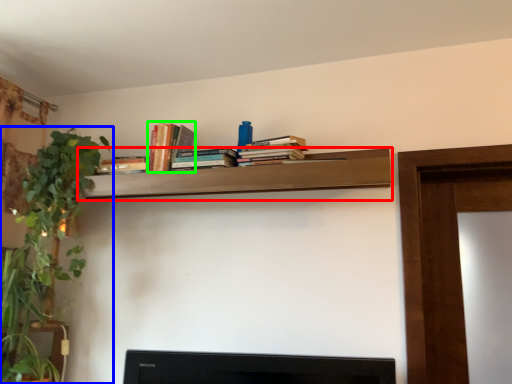
Question: Which object is the closest to the shelf (highlighted by a red box)? Choose among these: houseplant (highlighted by a blue box) or book (highlighted by a green box).

Choices:
 (A) houseplant
 (B) book

Answer: (B)